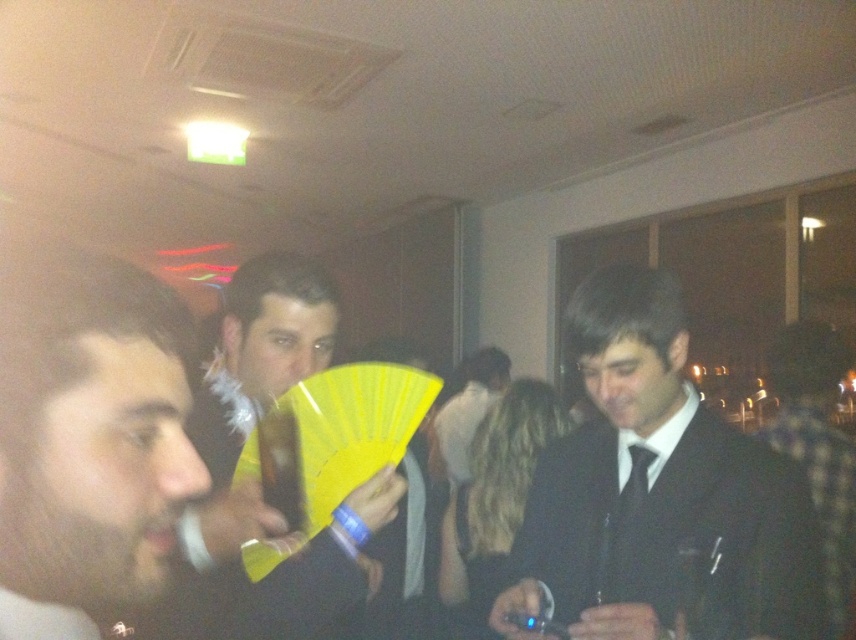
Looking at this image, who is taller, black satin suit at right or yellow paper fan at center?

Standing taller between the two is yellow paper fan at center.

Does point (605, 380) lie in front of point (274, 625)?

No, it is not.

Image resolution: width=856 pixels, height=640 pixels. What are the coordinates of `black satin suit at right` in the screenshot? It's located at (658, 496).

Can you confirm if black satin suit at right is taller than white fur coat at center?

Indeed, black satin suit at right has a greater height compared to white fur coat at center.

Which is behind, point (797, 573) or point (462, 408)?

Point (462, 408)

Find the location of `black satin suit at right`. black satin suit at right is located at coordinates (658, 496).

Is point (266, 579) less distant than point (831, 364)?

Yes, it is in front of point (831, 364).

Who is positioned more to the right, yellow paper fan at center or patterned fabric shirt at right?

patterned fabric shirt at right

This screenshot has width=856, height=640. I want to click on yellow paper fan at center, so click(260, 349).

I want to click on yellow paper fan at center, so click(x=260, y=349).